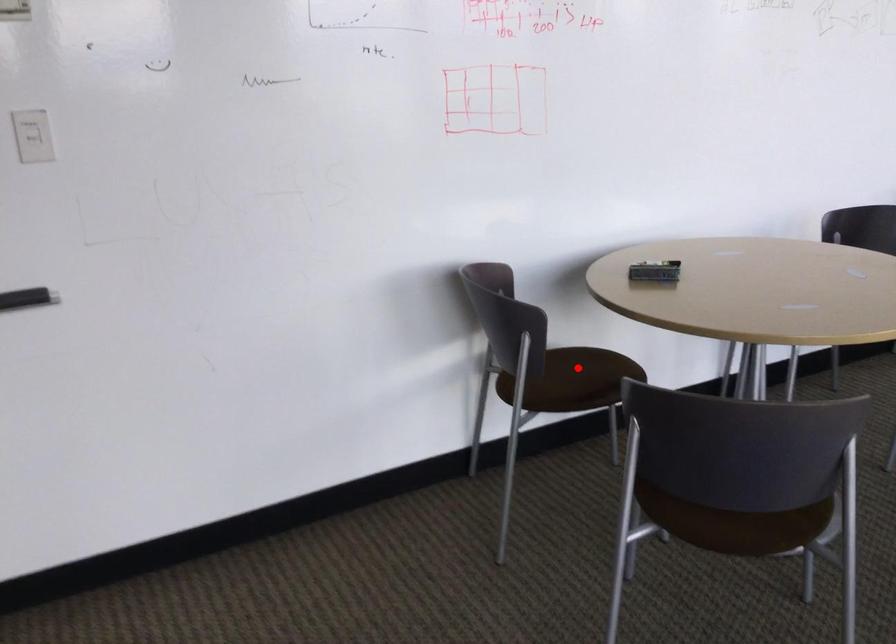
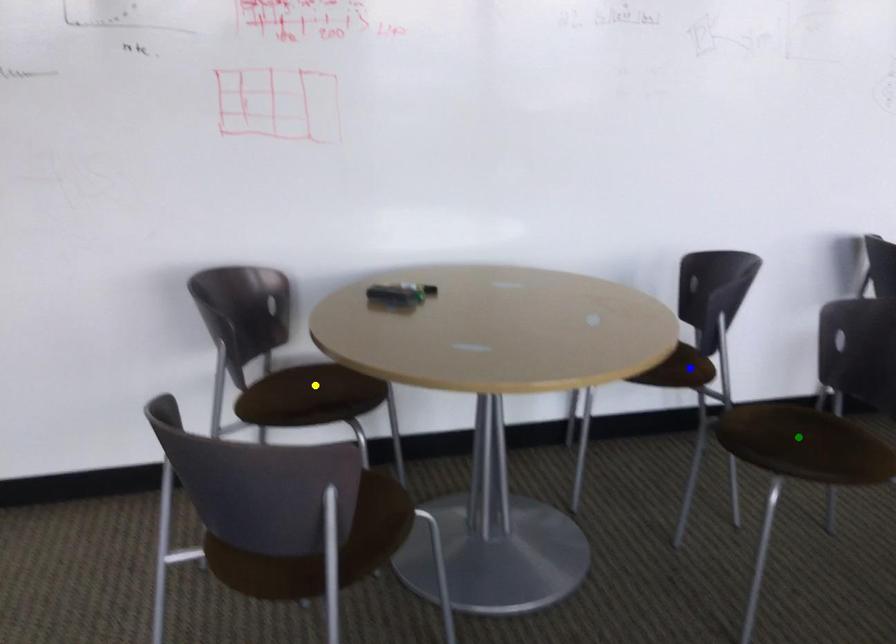
Question: I am providing you with two images of the same scene from different viewpoints. A red point is marked on the first image. You are given multiple points on the second image. Which point in image 2 is actually the same real-world point as the red point in image 1?

Choices:
 (A) yellow point
 (B) blue point
 (C) green point

Answer: (A)